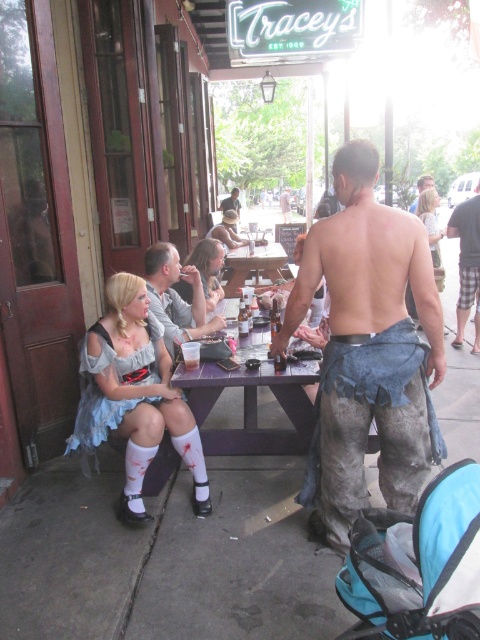
Is wooden picnic table at center bigger than smooth leather jacket at center?

Incorrect, wooden picnic table at center is not larger than smooth leather jacket at center.

Does wooden picnic table at center have a lesser width compared to smooth leather jacket at center?

In fact, wooden picnic table at center might be wider than smooth leather jacket at center.

Looking at this image, who is more forward, (263, 262) or (222, 205)?

Point (263, 262)

In order to click on wooden picnic table at center in this screenshot , I will do `click(253, 264)`.

Which of these two, purple wood table at center or smooth leather jacket at center, stands shorter?

With less height is purple wood table at center.

Can you confirm if purple wood table at center is smaller than smooth leather jacket at center?

Correct, purple wood table at center occupies less space than smooth leather jacket at center.

Locate an element on the screen. The width and height of the screenshot is (480, 640). purple wood table at center is located at coordinates (252, 406).

Can you confirm if purple wood table at center is bigger than plaid shorts at right?

No.

Looking at this image, who is more distant from viewer, [250,406] or [457,298]?

The point [457,298] is behind.

Identify the location of purple wood table at center. Image resolution: width=480 pixels, height=640 pixels. (252, 406).